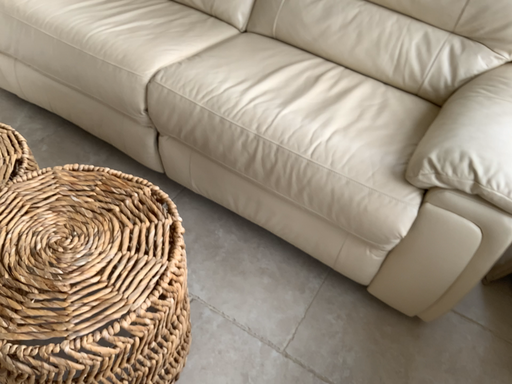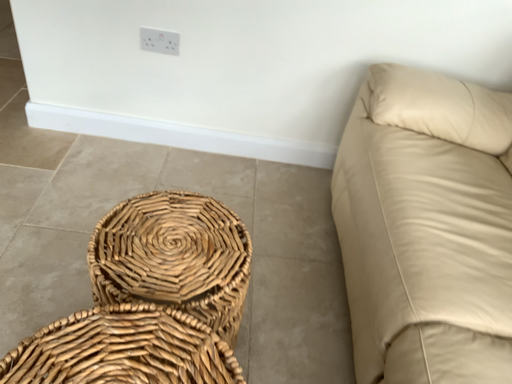
Question: Which way did the camera rotate in the video?

Choices:
 (A) rotated upward
 (B) rotated downward

Answer: (A)